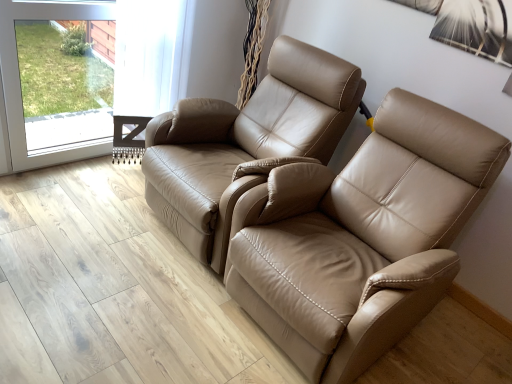
Question: From a real-world perspective, is tan leather chair at center, arranged as the second chair when viewed from the right, above or below tan leather recliner at center, the second chair in the left-to-right sequence?

Choices:
 (A) below
 (B) above

Answer: (B)

Question: Considering the positions of tan leather chair at center, arranged as the second chair when viewed from the right, and tan leather recliner at center, the second chair in the left-to-right sequence, in the image, is tan leather chair at center, arranged as the second chair when viewed from the right, wider or thinner than tan leather recliner at center, the second chair in the left-to-right sequence,?

Choices:
 (A) thin
 (B) wide

Answer: (A)

Question: Which is farther from the transparent glass screen door at upper left?

Choices:
 (A) tan leather recliner at center, the second chair in the left-to-right sequence
 (B) tan leather chair at center, arranged as the second chair when viewed from the right

Answer: (A)

Question: Based on their relative distances, which object is nearer to the tan leather recliner at center, the second chair in the left-to-right sequence?

Choices:
 (A) tan leather chair at center, the first chair from the left
 (B) transparent glass screen door at upper left

Answer: (A)